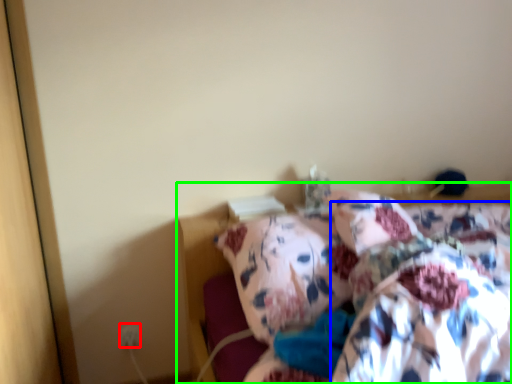
Question: Which is farther away from electric outlet (highlighted by a red box)? blanket (highlighted by a blue box) or bed (highlighted by a green box)?

Choices:
 (A) blanket
 (B) bed

Answer: (A)